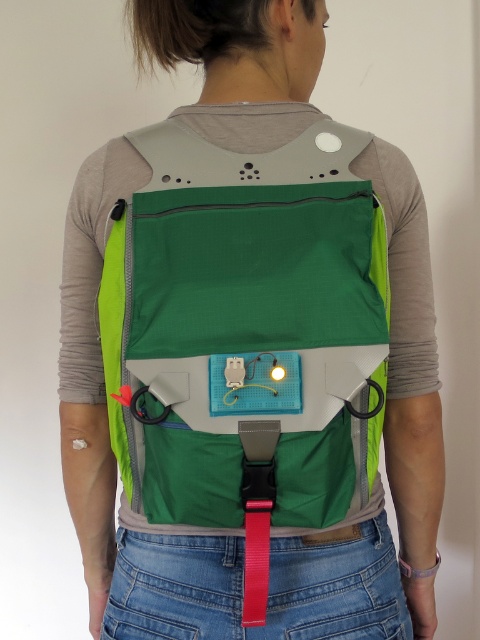
You are a tailor measuring the distance between the green fabric vest at center and the red matte strap at center on the backpack. The minimum required space for a safety pin is 0.5 inches. Can you fit a safety pin between them?

The distance between the green fabric vest at center and the red matte strap at center is 5.24 inches, which is more than the 0.5 inches needed for a safety pin. Therefore, you can fit a safety pin between them.

Based on the photo, you are standing directly in front of the backpack and notice two points marked on it. One is at coordinate point (x=325, y=410) and the other at point (x=250, y=484). Which point is closer to you?

Point (x=325, y=410) is closer to you because it is further to the viewer than point (x=250, y=484).

You are a fashion designer analyzing the backpack. You notice the green fabric vest at center and the red matte strap at center. Which one has a bigger surface area?

The green fabric vest at center has a larger surface area than the red matte strap at center.